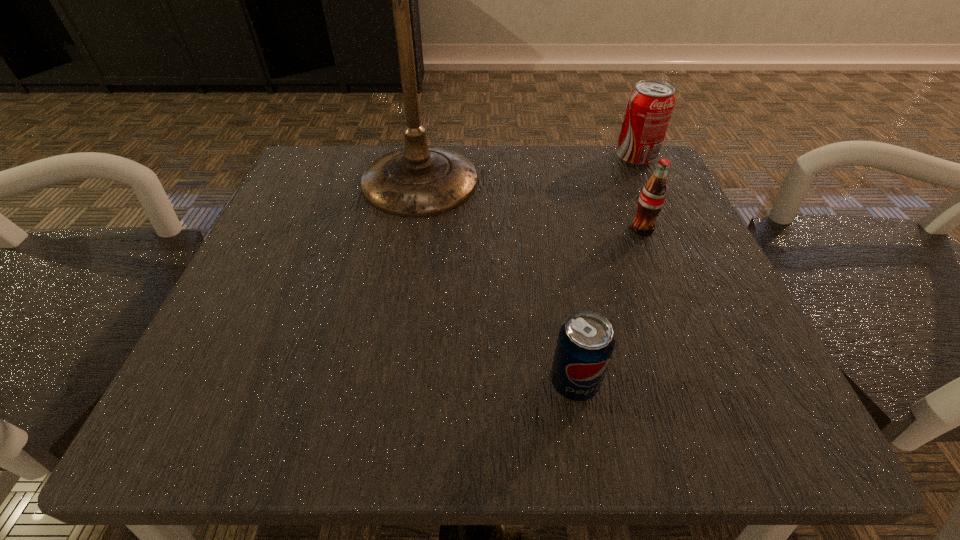
Where is `free space at the near left corner of the desktop`? The height and width of the screenshot is (540, 960). free space at the near left corner of the desktop is located at coordinates (284, 403).

At what (x,y) coordinates should I click in order to perform the action: click on vacant point at the far right corner. Please return your answer as a coordinate pair (x, y). The image size is (960, 540). Looking at the image, I should click on (607, 148).

Where is `free space at the near right corner of the desktop`? The height and width of the screenshot is (540, 960). free space at the near right corner of the desktop is located at coordinates (651, 374).

What are the coordinates of `vacant area between the second nearest soda can and the tallest object` in the screenshot? It's located at (530, 211).

Find the location of a particular element. The height and width of the screenshot is (540, 960). vacant area between the tallest object and the second nearest soda can is located at coordinates (530, 211).

Identify the location of free spot between the farthest soda can and the shortest soda can. This screenshot has height=540, width=960. (605, 270).

Where is `free space between the second nearest soda can and the farthest soda can`? The width and height of the screenshot is (960, 540). free space between the second nearest soda can and the farthest soda can is located at coordinates (639, 193).

Locate an element on the screen. This screenshot has height=540, width=960. vacant point located between the shortest object and the second farthest soda can is located at coordinates (608, 306).

Where is `free spot between the tallest object and the second farthest soda can`? free spot between the tallest object and the second farthest soda can is located at coordinates (530, 211).

Where is `vacant region between the second nearest soda can and the farthest soda can`? vacant region between the second nearest soda can and the farthest soda can is located at coordinates (639, 193).